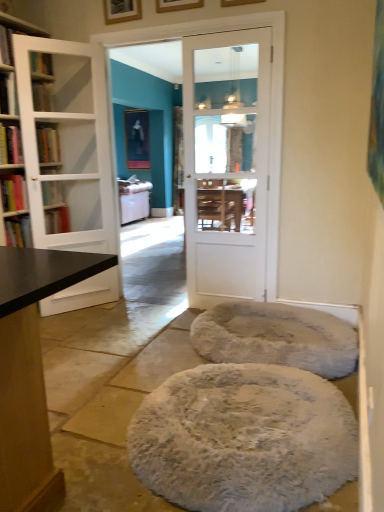
Question: Does white glossy door at center, positioned as the first door in right-to-left order, have a lesser height compared to white fluffy pouf at center?

Choices:
 (A) yes
 (B) no

Answer: (B)

Question: From the image's perspective, is white glossy door at center, positioned as the first door in right-to-left order, on top of white fluffy pouf at center?

Choices:
 (A) yes
 (B) no

Answer: (A)

Question: Is white glossy door at center, positioned as the first door in right-to-left order, thinner than white fluffy pouf at center?

Choices:
 (A) yes
 (B) no

Answer: (A)

Question: Is white glossy door at center, positioned as the first door in right-to-left order, taller than white fluffy pouf at center?

Choices:
 (A) no
 (B) yes

Answer: (B)

Question: Is white glossy door at center, which ranks as the second door in left-to-right order, wider than white fluffy pouf at center?

Choices:
 (A) no
 (B) yes

Answer: (A)

Question: In the image, is white glass door at left, which is counted as the second door, starting from the right, on the left side or the right side of black matte bookshelf at left, placed as the 1th book when sorted from bottom to top?

Choices:
 (A) left
 (B) right

Answer: (B)

Question: From the image's perspective, is white glass door at left, the 1th door in the left-to-right sequence, positioned above or below black matte bookshelf at left, which is the fourth book from top to bottom?

Choices:
 (A) below
 (B) above

Answer: (B)

Question: Which is correct: white glass door at left, which is counted as the second door, starting from the right, is inside black matte bookshelf at left, which is the fourth book from top to bottom, or outside of it?

Choices:
 (A) outside
 (B) inside

Answer: (A)

Question: Is point (99, 157) closer or farther from the camera than point (23, 239)?

Choices:
 (A) farther
 (B) closer

Answer: (A)

Question: Based on their positions, is white glossy door at center, which ranks as the second door in left-to-right order, located to the left or right of hardcover book at left, positioned as the 4th book in bottom-to-top order?

Choices:
 (A) left
 (B) right

Answer: (B)

Question: Looking at the image, does white glossy door at center, which ranks as the second door in left-to-right order, seem bigger or smaller compared to hardcover book at left, positioned as the 4th book in bottom-to-top order?

Choices:
 (A) small
 (B) big

Answer: (B)

Question: Does point (246, 287) appear closer or farther from the camera than point (16, 100)?

Choices:
 (A) closer
 (B) farther

Answer: (B)

Question: Is white glossy door at center, which ranks as the second door in left-to-right order, taller or shorter than hardcover book at left, positioned as the 4th book in bottom-to-top order?

Choices:
 (A) short
 (B) tall

Answer: (B)

Question: From a real-world perspective, is white fluffy cat bed at center positioned above or below white glossy door at center, positioned as the first door in right-to-left order?

Choices:
 (A) below
 (B) above

Answer: (A)

Question: Visually, is white fluffy cat bed at center positioned to the left or to the right of white glossy door at center, positioned as the first door in right-to-left order?

Choices:
 (A) left
 (B) right

Answer: (B)